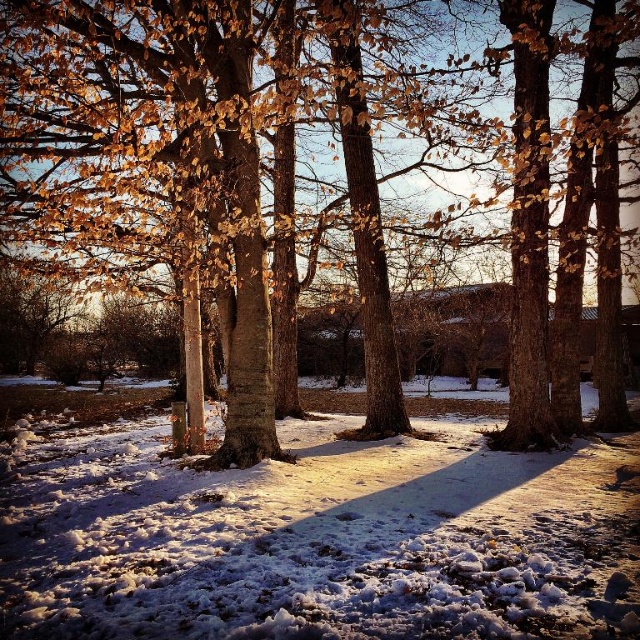
Is brown textured bark at center positioned at the back of white fluffy snow at center?

Yes.

Is point (428, 72) farther from camera compared to point (605, 618)?

Yes, it is behind point (605, 618).

Measure the distance between brown textured bark at center and camera.

25.25 feet

Identify the location of brown textured bark at center. (147, 156).